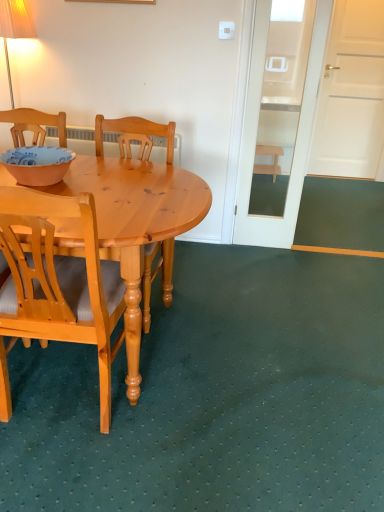
Locate an element on the screen. free space in front of light brown wood chair at left, which is counted as the second chair, starting from the back is located at coordinates (90, 476).